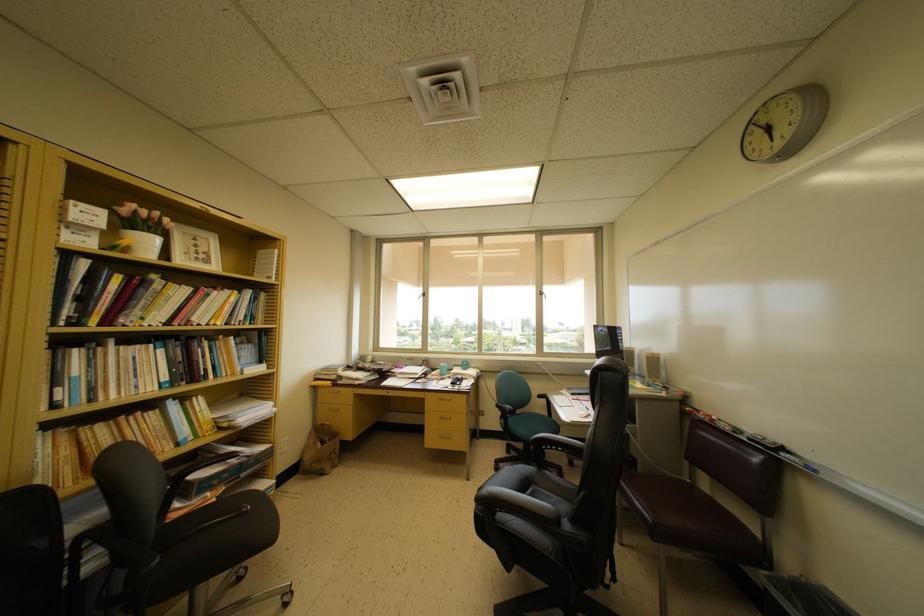
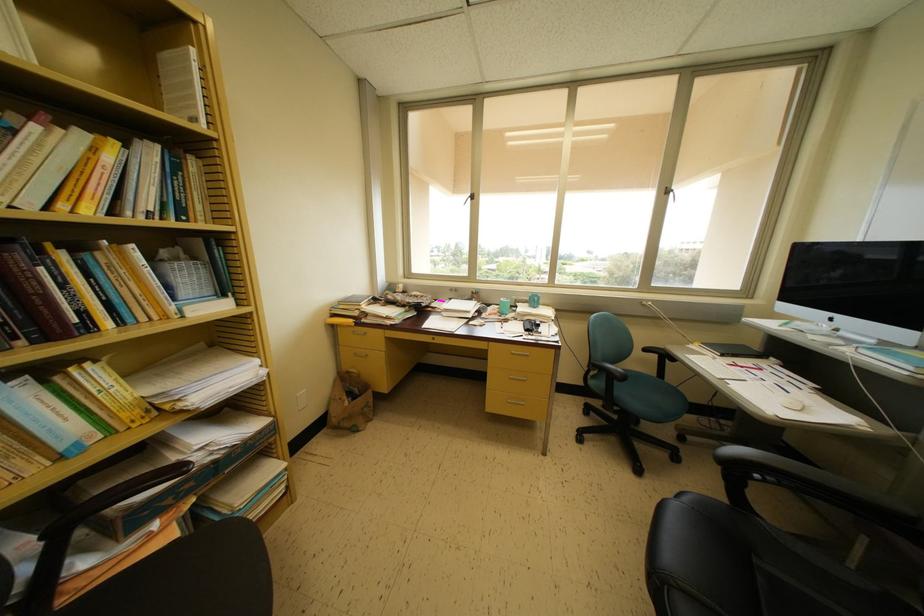
Find the pixel in the second image that matches (x=543, y=297) in the first image.

(671, 193)